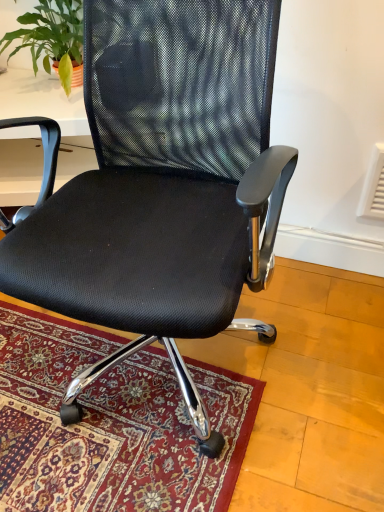
You are a GUI agent. You are given a task and a screenshot of the screen. Output one action in this format:
    pyautogui.click(x=<x>, y=<y>)
    Task: Click on the black mesh office chair at center
    
    Given the screenshot: What is the action you would take?
    pyautogui.click(x=164, y=185)

The height and width of the screenshot is (512, 384). What do you see at coordinates (164, 185) in the screenshot? I see `black mesh office chair at center` at bounding box center [164, 185].

The height and width of the screenshot is (512, 384). Describe the element at coordinates (52, 38) in the screenshot. I see `green leafy plant at upper left` at that location.

You are a GUI agent. You are given a task and a screenshot of the screen. Output one action in this format:
    pyautogui.click(x=<x>, y=<y>)
    Task: Click on the green leafy plant at upper left
    The height and width of the screenshot is (512, 384).
    Given the screenshot: What is the action you would take?
    point(52,38)

The image size is (384, 512). I want to click on black mesh office chair at center, so click(x=164, y=185).

Visually, is black mesh office chair at center positioned to the left or to the right of green leafy plant at upper left?

Based on their positions, black mesh office chair at center is located to the right of green leafy plant at upper left.

Is the position of black mesh office chair at center less distant than that of green leafy plant at upper left?

Yes, black mesh office chair at center is closer to the camera.

Which is closer, [183,258] or [77,13]?

Point [183,258] is closer to the camera than point [77,13].

From the image's perspective, would you say black mesh office chair at center is shown under green leafy plant at upper left?

Correct, black mesh office chair at center appears lower than green leafy plant at upper left in the image.

From a real-world perspective, is black mesh office chair at center below green leafy plant at upper left?

Yes, from a real-world perspective, black mesh office chair at center is beneath green leafy plant at upper left.

Considering the sizes of black mesh office chair at center and green leafy plant at upper left in the image, is black mesh office chair at center wider or thinner than green leafy plant at upper left?

Considering their sizes, black mesh office chair at center looks broader than green leafy plant at upper left.

Which of these two, black mesh office chair at center or green leafy plant at upper left, stands shorter?

With less height is green leafy plant at upper left.

Looking at the image, does black mesh office chair at center seem bigger or smaller compared to green leafy plant at upper left?

Clearly, black mesh office chair at center is larger in size than green leafy plant at upper left.

Is green leafy plant at upper left surrounded by black mesh office chair at center?

No, black mesh office chair at center does not contain green leafy plant at upper left.

Would you say black mesh office chair at center is a long distance from green leafy plant at upper left?

No, black mesh office chair at center is in close proximity to green leafy plant at upper left.

Could you tell me if black mesh office chair at center is facing green leafy plant at upper left?

No, black mesh office chair at center does not turn towards green leafy plant at upper left.

Measure the distance from black mesh office chair at center to green leafy plant at upper left.

They are 33.14 inches apart.

In the image, there is a black mesh office chair at center. Where is `houseplant above it (from the image's perspective)`? The height and width of the screenshot is (512, 384). houseplant above it (from the image's perspective) is located at coordinates (52, 38).

From the picture: Considering the positions of objects green leafy plant at upper left and black mesh office chair at center in the image provided, who is more to the right, green leafy plant at upper left or black mesh office chair at center?

Positioned to the right is black mesh office chair at center.

Looking at this image, considering the positions of objects green leafy plant at upper left and black mesh office chair at center in the image provided, who is behind, green leafy plant at upper left or black mesh office chair at center?

green leafy plant at upper left is more distant.

Between point (9, 42) and point (238, 153), which one is positioned in front?

Point (238, 153)

From the image's perspective, is green leafy plant at upper left on top of black mesh office chair at center?

Yes, from the image's perspective, green leafy plant at upper left is over black mesh office chair at center.

In the scene shown: From a real-world perspective, is green leafy plant at upper left under black mesh office chair at center?

No.

From the picture: Does green leafy plant at upper left have a lesser width compared to black mesh office chair at center?

Yes, green leafy plant at upper left is thinner than black mesh office chair at center.

Who is taller, green leafy plant at upper left or black mesh office chair at center?

Standing taller between the two is black mesh office chair at center.

Which of these two, green leafy plant at upper left or black mesh office chair at center, is smaller?

Smaller between the two is green leafy plant at upper left.

Based on the photo, does green leafy plant at upper left contain black mesh office chair at center?

Definitely not — black mesh office chair at center is not inside green leafy plant at upper left.

Is green leafy plant at upper left far away from black mesh office chair at center?

No, there isn't a large distance between green leafy plant at upper left and black mesh office chair at center.

Is green leafy plant at upper left looking in the opposite direction of black mesh office chair at center?

No.

Identify the location of chair that is in front of the green leafy plant at upper left. The image size is (384, 512). (164, 185).

Find the location of `houseplant that appears above the black mesh office chair at center (from the image's perspective)`. houseplant that appears above the black mesh office chair at center (from the image's perspective) is located at coordinates (52, 38).

Where is `chair below the green leafy plant at upper left (from a real-world perspective)`? The image size is (384, 512). chair below the green leafy plant at upper left (from a real-world perspective) is located at coordinates (164, 185).